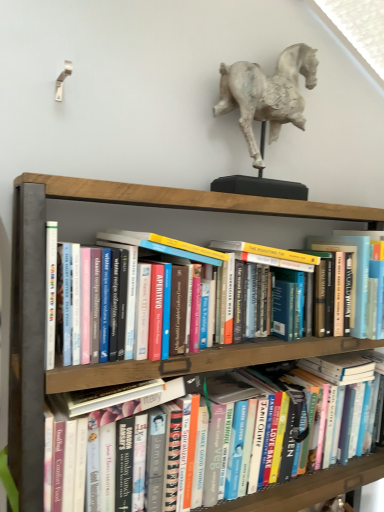
Describe the element at coordinates (315, 486) in the screenshot. I see `hardcover book at center` at that location.

Where is `hardcover book at center`? Image resolution: width=384 pixels, height=512 pixels. hardcover book at center is located at coordinates (315, 486).

Between white plaster horse at upper center and hardcover book at center, which one has larger width?

Wider between the two is hardcover book at center.

Does white plaster horse at upper center have a lesser height compared to hardcover book at center?

No, white plaster horse at upper center is not shorter than hardcover book at center.

Which is further, (288, 87) or (317, 485)?

The point (288, 87) is farther.

Is white plaster horse at upper center aimed at hardcover book at center?

No, white plaster horse at upper center is not turned towards hardcover book at center.

Considering their positions, is wooden bookshelf at center located in front of or behind hardcover book at center?

Clearly, wooden bookshelf at center is in front of hardcover book at center.

Is wooden bookshelf at center bigger than hardcover book at center?

Yes.

Is hardcover book at center located within wooden bookshelf at center?

Indeed, hardcover book at center is located within wooden bookshelf at center.

Are wooden bookshelf at center and hardcover book at center beside each other?

wooden bookshelf at center and hardcover book at center are not in contact.

Considering the relative positions of hardcover book at center and white plaster horse at upper center in the image provided, is hardcover book at center to the left of white plaster horse at upper center from the viewer's perspective?

Incorrect, hardcover book at center is not on the left side of white plaster horse at upper center.

Can we say hardcover book at center lies outside white plaster horse at upper center?

hardcover book at center lies outside white plaster horse at upper center's area.

Locate an element on the screen. Image resolution: width=384 pixels, height=512 pixels. book to the right of white plaster horse at upper center is located at coordinates (315, 486).

Is hardcover book at center oriented away from white plaster horse at upper center?

hardcover book at center is not turned away from white plaster horse at upper center.

Is wooden bookshelf at center bigger than white plaster horse at upper center?

Yes.

The image size is (384, 512). Identify the location of shelf beneath the white plaster horse at upper center (from a real-world perspective). (44, 285).

Is wooden bookshelf at center further to the viewer compared to white plaster horse at upper center?

No, wooden bookshelf at center is in front of white plaster horse at upper center.

From a real-world perspective, who is located higher, hardcover book at center or wooden bookshelf at center?

wooden bookshelf at center, from a real-world perspective.

From the image's perspective, which one is positioned lower, hardcover book at center or wooden bookshelf at center?

hardcover book at center, from the image's perspective.

Are hardcover book at center and wooden bookshelf at center making contact?

No, hardcover book at center is not in contact with wooden bookshelf at center.

I want to click on shelf lying in front of the hardcover book at center, so click(44, 285).

Choose the correct answer: Is white plaster horse at upper center inside wooden bookshelf at center or outside it?

white plaster horse at upper center is located beyond the bounds of wooden bookshelf at center.

Is white plaster horse at upper center not near wooden bookshelf at center?

No, white plaster horse at upper center is not far away from wooden bookshelf at center.

Does white plaster horse at upper center have a larger size compared to wooden bookshelf at center?

No.

Is white plaster horse at upper center positioned with its back to wooden bookshelf at center?

That's not correct — white plaster horse at upper center is not looking away from wooden bookshelf at center.

Locate an element on the screen. horse above the hardcover book at center (from a real-world perspective) is located at coordinates (267, 94).

The image size is (384, 512). Identify the location of shelf in front of the hardcover book at center. (44, 285).

From the image, which object appears to be nearer to white plaster horse at upper center, hardcover book at center or wooden bookshelf at center?

wooden bookshelf at center.

Based on their spatial positions, is white plaster horse at upper center or wooden bookshelf at center closer to hardcover book at center?

wooden bookshelf at center.

Considering their positions, is white plaster horse at upper center positioned closer to wooden bookshelf at center than hardcover book at center?

The object closer to wooden bookshelf at center is white plaster horse at upper center.

Looking at the image, which one is located closer to white plaster horse at upper center, wooden bookshelf at center or hardcover book at center?

wooden bookshelf at center lies closer to white plaster horse at upper center than the other object.

Considering their positions, is hardcover book at center positioned further to wooden bookshelf at center than white plaster horse at upper center?

The object further to wooden bookshelf at center is hardcover book at center.

Looking at the image, which one is located further to hardcover book at center, wooden bookshelf at center or white plaster horse at upper center?

Based on the image, white plaster horse at upper center appears to be further to hardcover book at center.

The width and height of the screenshot is (384, 512). Identify the location of shelf that lies between white plaster horse at upper center and hardcover book at center from top to bottom. (44, 285).